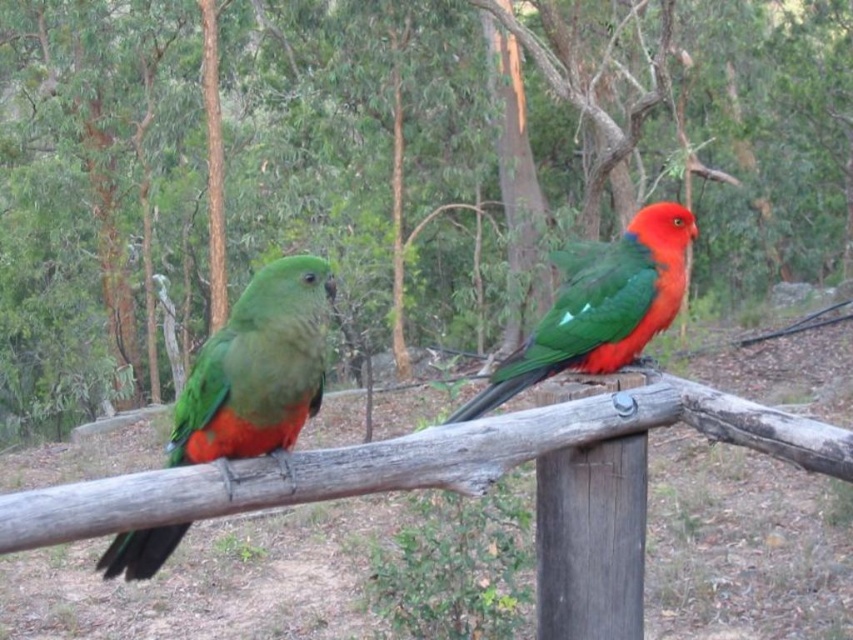
Question: From the image, what is the correct spatial relationship of green matte parrot at left in relation to shiny green parrot at center?

Choices:
 (A) right
 (B) left

Answer: (B)

Question: Which point appears farthest from the camera in this image?

Choices:
 (A) (253, 342)
 (B) (100, 122)
 (C) (486, 396)

Answer: (B)

Question: Which object is the farthest from the shiny green parrot at center?

Choices:
 (A) green wood tree at center
 (B) green matte parrot at left
 (C) wooden post at center

Answer: (A)

Question: Which point is closer to the camera?

Choices:
 (A) shiny green parrot at center
 (B) green matte parrot at left
 (C) green wood tree at center
 (D) wooden post at center

Answer: (B)

Question: Is green matte parrot at left thinner than wooden post at center?

Choices:
 (A) yes
 (B) no

Answer: (B)

Question: Does wooden post at center appear under shiny green parrot at center?

Choices:
 (A) no
 (B) yes

Answer: (B)